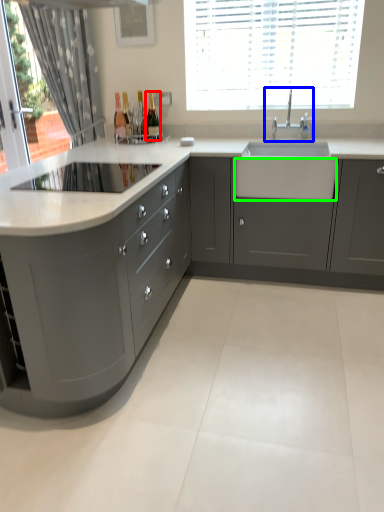
Question: Which object is the closest to the bottle (highlighted by a red box)? Choose among these: tap (highlighted by a blue box) or drawer (highlighted by a green box).

Choices:
 (A) tap
 (B) drawer

Answer: (A)